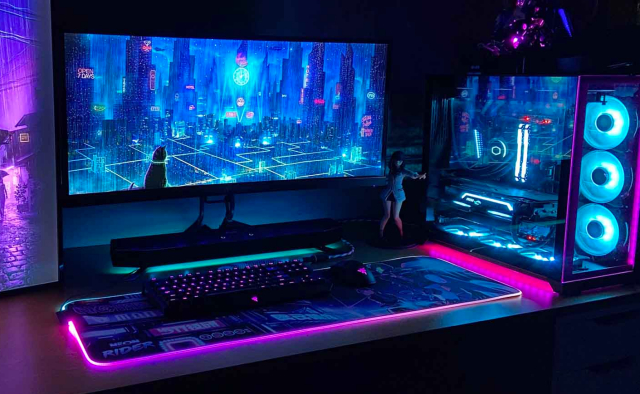
Identify the location of desktop mat. Image resolution: width=640 pixels, height=394 pixels. (258, 321).